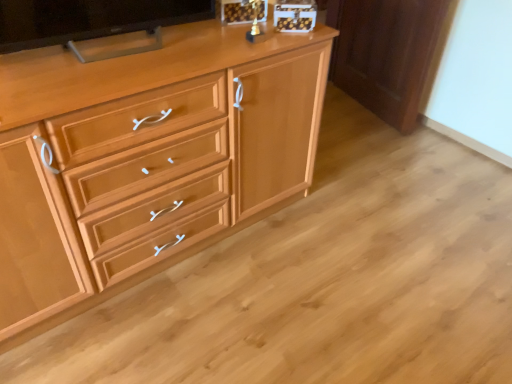
Image resolution: width=512 pixels, height=384 pixels. Find the location of `free location to the right of matte black tv at upper left`. free location to the right of matte black tv at upper left is located at coordinates (203, 50).